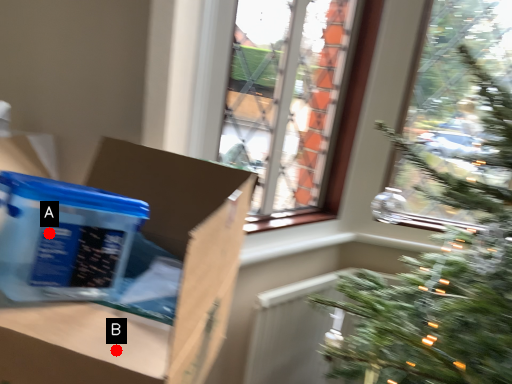
Question: Two points are circled on the image, labeled by A and B beside each circle. Which point is closer to the camera taking this photo?

Choices:
 (A) A is closer
 (B) B is closer

Answer: (B)